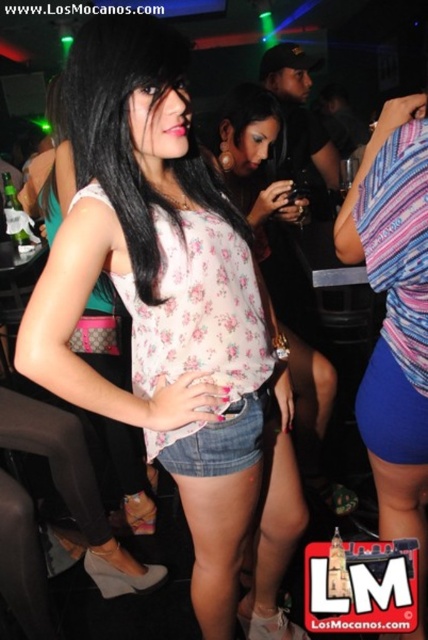
Question: Is floral fabric blouse at center bigger than clear glass bottle at center?

Choices:
 (A) no
 (B) yes

Answer: (B)

Question: Which of the following is the farthest from the observer?

Choices:
 (A) (8, 220)
 (B) (121, 259)

Answer: (A)

Question: Which of the following is the farthest from the observer?

Choices:
 (A) [x=178, y=224]
 (B) [x=217, y=186]
 (C) [x=17, y=236]

Answer: (C)

Question: Among these objects, which one is nearest to the camera?

Choices:
 (A) floral fabric top at center
 (B) floral fabric blouse at center

Answer: (B)

Question: Can you confirm if floral fabric top at center is positioned below clear glass bottle at center?

Choices:
 (A) yes
 (B) no

Answer: (A)

Question: Is the position of floral fabric blouse at center more distant than that of clear glass bottle at center?

Choices:
 (A) yes
 (B) no

Answer: (B)